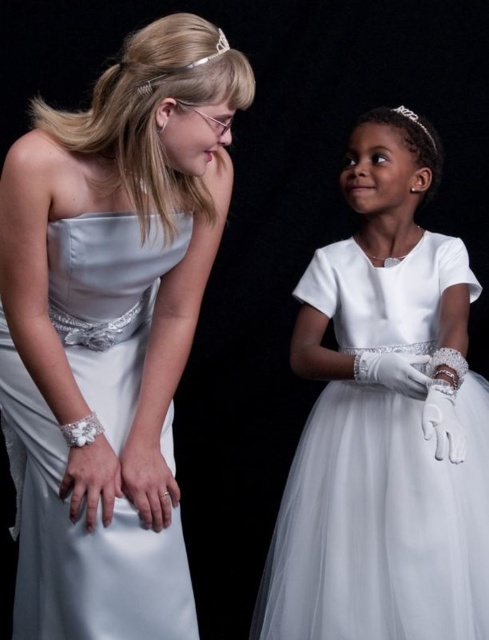
Question: Does clear crystal tiara at upper center have a smaller size compared to silver metallic tiara at upper center?

Choices:
 (A) no
 (B) yes

Answer: (B)

Question: Can you confirm if satin dress at center is wider than silver metallic tiara at upper center?

Choices:
 (A) yes
 (B) no

Answer: (A)

Question: Among these points, which one is nearest to the camera?

Choices:
 (A) (434, 141)
 (B) (88, 180)

Answer: (B)

Question: Which of the following is the farthest from the observer?

Choices:
 (A) silver metallic tiara at upper center
 (B) white tulle dress at center

Answer: (A)

Question: Does white tulle dress at center have a lesser width compared to silver metallic tiara at upper center?

Choices:
 (A) no
 (B) yes

Answer: (A)

Question: Which of the following is the farthest from the observer?

Choices:
 (A) (217, 44)
 (B) (410, 113)
 (C) (1, 195)
 (D) (339, 428)

Answer: (B)